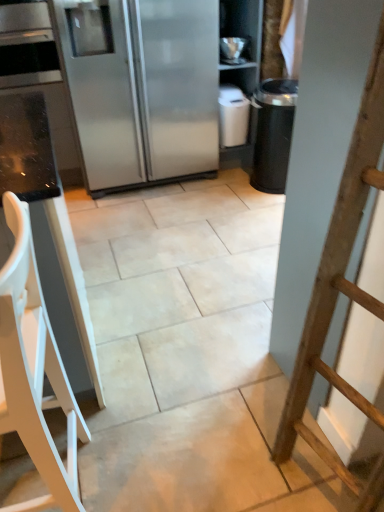
Question: Is white plastic chair at left taller or shorter than satin silver refrigerator at upper left?

Choices:
 (A) tall
 (B) short

Answer: (B)

Question: Looking at the image, does white plastic chair at left seem bigger or smaller compared to satin silver refrigerator at upper left?

Choices:
 (A) small
 (B) big

Answer: (A)

Question: Is white plastic chair at left to the left or to the right of satin silver refrigerator at upper left in the image?

Choices:
 (A) right
 (B) left

Answer: (B)

Question: Is satin silver refrigerator at upper left bigger or smaller than white plastic chair at left?

Choices:
 (A) big
 (B) small

Answer: (A)

Question: Is satin silver refrigerator at upper left situated inside white plastic chair at left or outside?

Choices:
 (A) inside
 (B) outside

Answer: (B)

Question: Is satin silver refrigerator at upper left in front of or behind white plastic chair at left in the image?

Choices:
 (A) behind
 (B) front

Answer: (A)

Question: From the image's perspective, is satin silver refrigerator at upper left positioned above or below white plastic chair at left?

Choices:
 (A) below
 (B) above

Answer: (B)